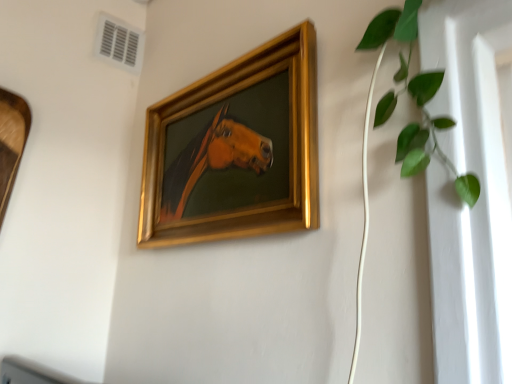
Identify the location of gold/gilded picture frame at center. Image resolution: width=512 pixels, height=384 pixels. pos(234,149).

From a real-world perspective, who is located higher, gold/gilded picture frame at center or green leafy plant at upper right?

green leafy plant at upper right is physically above.

Is gold/gilded picture frame at center turned away from green leafy plant at upper right?

gold/gilded picture frame at center does not have its back to green leafy plant at upper right.

Considering the positions of objects gold/gilded picture frame at center and green leafy plant at upper right in the image provided, who is more to the left, gold/gilded picture frame at center or green leafy plant at upper right?

Positioned to the left is gold/gilded picture frame at center.

How many degrees apart are the facing directions of gold/gilded picture frame at center and green leafy plant at upper right?

The angular difference between gold/gilded picture frame at center and green leafy plant at upper right is 0.0112 degrees.

Can you confirm if green leafy plant at upper right is taller than white plastic air conditioning at upper left?

Indeed, green leafy plant at upper right has a greater height compared to white plastic air conditioning at upper left.

Considering the relative positions of green leafy plant at upper right and white plastic air conditioning at upper left in the image provided, is green leafy plant at upper right to the left of white plastic air conditioning at upper left from the viewer's perspective?

Incorrect, green leafy plant at upper right is not on the left side of white plastic air conditioning at upper left.

Does green leafy plant at upper right lie behind white plastic air conditioning at upper left?

No.

From a real-world perspective, is gold/gilded picture frame at center over white plastic air conditioning at upper left?

Actually, gold/gilded picture frame at center is physically below white plastic air conditioning at upper left in the real world.

Which object is thinner, gold/gilded picture frame at center or white plastic air conditioning at upper left?

white plastic air conditioning at upper left is thinner.

Is point (236, 230) behind point (123, 41)?

No, (236, 230) is in front of (123, 41).

Is gold/gilded picture frame at center smaller than white plastic air conditioning at upper left?

No.

Considering the sizes of objects green leafy plant at upper right and gold/gilded picture frame at center in the image provided, who is shorter, green leafy plant at upper right or gold/gilded picture frame at center?

Standing shorter between the two is green leafy plant at upper right.

Is green leafy plant at upper right not within gold/gilded picture frame at center?

Yes.

How different are the orientations of green leafy plant at upper right and gold/gilded picture frame at center in degrees?

The angular difference between green leafy plant at upper right and gold/gilded picture frame at center is 0.0112 degrees.

Is green leafy plant at upper right oriented towards gold/gilded picture frame at center?

No, green leafy plant at upper right is not oriented towards gold/gilded picture frame at center.

Considering the sizes of white plastic air conditioning at upper left and green leafy plant at upper right in the image, is white plastic air conditioning at upper left taller or shorter than green leafy plant at upper right?

In the image, white plastic air conditioning at upper left appears to be shorter than green leafy plant at upper right.

Measure the distance from white plastic air conditioning at upper left to green leafy plant at upper right.

white plastic air conditioning at upper left and green leafy plant at upper right are 1.03 meters apart.

Can you confirm if white plastic air conditioning at upper left is wider than green leafy plant at upper right?

No, white plastic air conditioning at upper left is not wider than green leafy plant at upper right.

Is white plastic air conditioning at upper left inside or outside of green leafy plant at upper right?

white plastic air conditioning at upper left cannot be found inside green leafy plant at upper right.

Is point (115, 51) positioned in front of point (298, 92)?

No, it is not.

Would you say white plastic air conditioning at upper left is inside or outside gold/gilded picture frame at center?

white plastic air conditioning at upper left lies outside gold/gilded picture frame at center.

Considering their positions, is white plastic air conditioning at upper left located in front of or behind gold/gilded picture frame at center?

Visually, white plastic air conditioning at upper left is located behind gold/gilded picture frame at center.

Can you tell me how much white plastic air conditioning at upper left and gold/gilded picture frame at center differ in facing direction?

The facing directions of white plastic air conditioning at upper left and gold/gilded picture frame at center are 88.6 degrees apart.

Identify the location of houseplant lying in front of the gold/gilded picture frame at center. (417, 99).

You are a GUI agent. You are given a task and a screenshot of the screen. Output one action in this format:
    pyautogui.click(x=<x>, y=<y>)
    Task: Click on the air conditioning that is above the green leafy plant at upper right (from a real-world perspective)
    
    Given the screenshot: What is the action you would take?
    pyautogui.click(x=119, y=43)

Looking at the image, which one is located further to gold/gilded picture frame at center, white plastic air conditioning at upper left or green leafy plant at upper right?

white plastic air conditioning at upper left.

Consider the image. Considering their positions, is green leafy plant at upper right positioned closer to gold/gilded picture frame at center than white plastic air conditioning at upper left?

green leafy plant at upper right lies closer to gold/gilded picture frame at center than the other object.

Based on their spatial positions, is green leafy plant at upper right or gold/gilded picture frame at center closer to white plastic air conditioning at upper left?

gold/gilded picture frame at center is positioned closer to the anchor white plastic air conditioning at upper left.

Estimate the real-world distances between objects in this image. Which object is closer to green leafy plant at upper right, white plastic air conditioning at upper left or gold/gilded picture frame at center?

gold/gilded picture frame at center is positioned closer to the anchor green leafy plant at upper right.

Which object lies nearer to the anchor point white plastic air conditioning at upper left, gold/gilded picture frame at center or green leafy plant at upper right?

gold/gilded picture frame at center lies closer to white plastic air conditioning at upper left than the other object.

Which object lies further to the anchor point green leafy plant at upper right, gold/gilded picture frame at center or white plastic air conditioning at upper left?

The object further to green leafy plant at upper right is white plastic air conditioning at upper left.

This screenshot has width=512, height=384. Identify the location of picture frame located between green leafy plant at upper right and white plastic air conditioning at upper left in the depth direction. (234, 149).